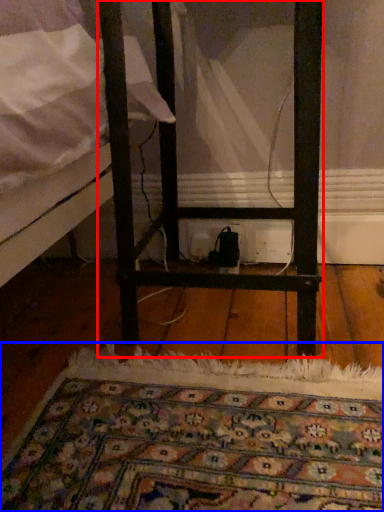
Question: Which point is closer to the camera, furniture (highlighted by a red box) or mat (highlighted by a blue box)?

Choices:
 (A) furniture
 (B) mat

Answer: (B)